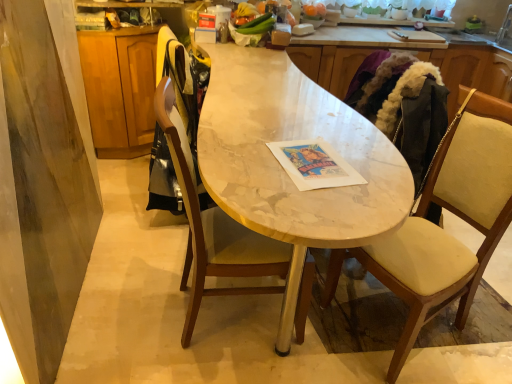
Question: Is beige fabric chair at right, the second chair from the left, directly adjacent to marble table at center?

Choices:
 (A) yes
 (B) no

Answer: (B)

Question: Can you confirm if beige fabric chair at right, the second chair from the left, is thinner than marble table at center?

Choices:
 (A) yes
 (B) no

Answer: (A)

Question: Is beige fabric chair at right, which is the 1th chair in right-to-left order, taller than marble table at center?

Choices:
 (A) no
 (B) yes

Answer: (B)

Question: Is beige fabric chair at right, which is the 1th chair in right-to-left order, shorter than marble table at center?

Choices:
 (A) no
 (B) yes

Answer: (A)

Question: From the image's perspective, would you say beige fabric chair at right, the second chair from the left, is shown under marble table at center?

Choices:
 (A) no
 (B) yes

Answer: (B)

Question: Is beige fabric chair at right, the second chair from the left, at the left side of marble table at center?

Choices:
 (A) no
 (B) yes

Answer: (A)

Question: Does white marble countertop at center lie behind silver metallic faucet at upper right?

Choices:
 (A) no
 (B) yes

Answer: (A)

Question: Considering the relative sizes of white marble countertop at center and silver metallic faucet at upper right in the image provided, is white marble countertop at center smaller than silver metallic faucet at upper right?

Choices:
 (A) no
 (B) yes

Answer: (A)

Question: Is the position of white marble countertop at center less distant than that of silver metallic faucet at upper right?

Choices:
 (A) yes
 (B) no

Answer: (A)

Question: Is white marble countertop at center not near silver metallic faucet at upper right?

Choices:
 (A) no
 (B) yes

Answer: (B)

Question: Is white marble countertop at center at the left side of silver metallic faucet at upper right?

Choices:
 (A) yes
 (B) no

Answer: (A)

Question: From the image's perspective, does white marble countertop at center appear lower than silver metallic faucet at upper right?

Choices:
 (A) yes
 (B) no

Answer: (A)

Question: Considering the relative positions of wooden chair at center, arranged as the first chair when viewed from the left, and white marble countertop at center in the image provided, is wooden chair at center, arranged as the first chair when viewed from the left, in front of white marble countertop at center?

Choices:
 (A) yes
 (B) no

Answer: (A)